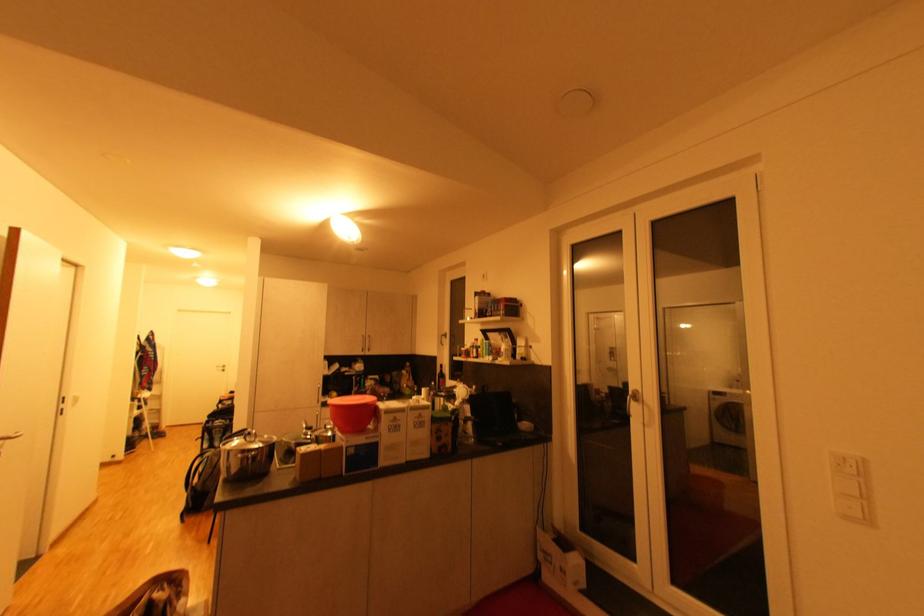
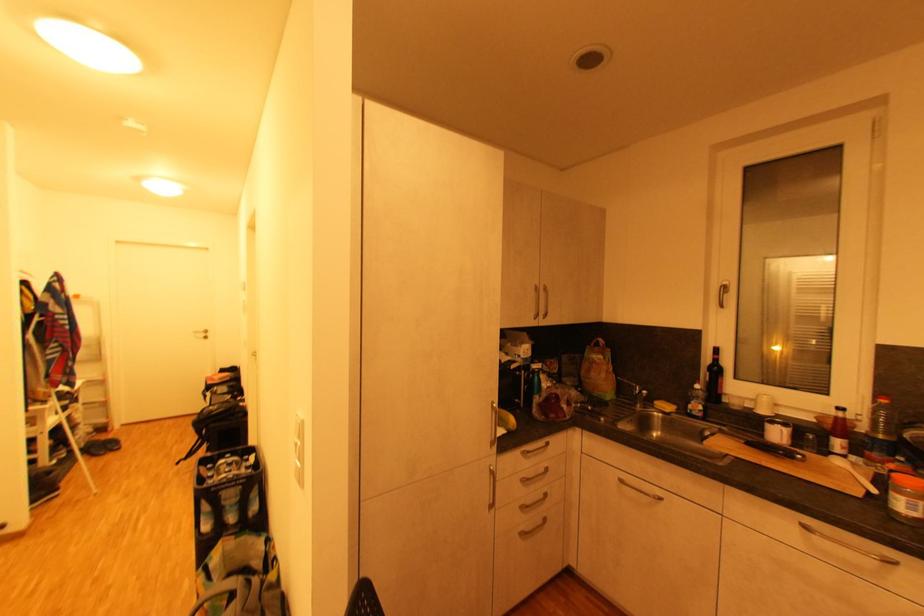
Which direction would the cameraman need to move to produce the second image?

The cameraman moved toward left, forward.